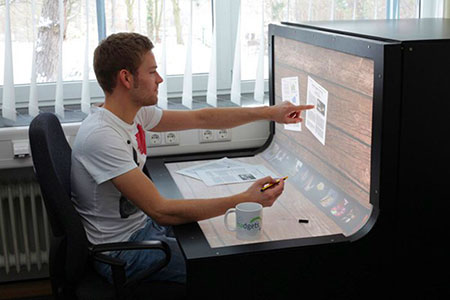
Find the location of `heater`. heater is located at coordinates (21, 236).